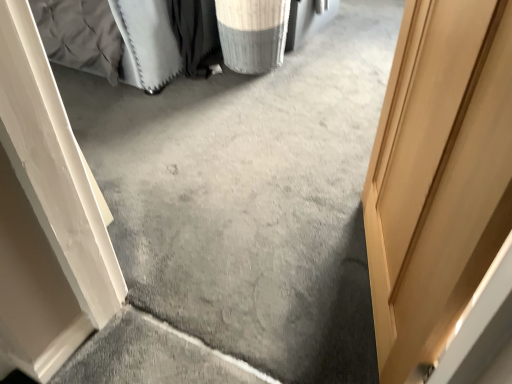
Describe the element at coordinates (252, 34) in the screenshot. I see `white textured laundry basket at upper center` at that location.

Identify the location of white textured laundry basket at upper center. Image resolution: width=512 pixels, height=384 pixels. (252, 34).

The width and height of the screenshot is (512, 384). Identify the location of light brown wooden door at right. (438, 175).

The image size is (512, 384). What do you see at coordinates (438, 175) in the screenshot?
I see `light brown wooden door at right` at bounding box center [438, 175].

You are a GUI agent. You are given a task and a screenshot of the screen. Output one action in this format:
    pyautogui.click(x=<x>, y=<y>)
    Task: Click on the white textured laundry basket at upper center
    
    Given the screenshot: What is the action you would take?
    pyautogui.click(x=252, y=34)

Which is more to the left, light brown wooden door at right or white textured laundry basket at upper center?

white textured laundry basket at upper center.

In the image, is light brown wooden door at right positioned in front of or behind white textured laundry basket at upper center?

light brown wooden door at right is in front of white textured laundry basket at upper center.

Which is nearer, (383, 280) or (253, 61)?

The point (383, 280) is closer to the camera.

From the image's perspective, would you say light brown wooden door at right is positioned over white textured laundry basket at upper center?

No.

From a real-world perspective, is light brown wooden door at right positioned under white textured laundry basket at upper center based on gravity?

Actually, light brown wooden door at right is physically above white textured laundry basket at upper center in the real world.

Which of these two, light brown wooden door at right or white textured laundry basket at upper center, is thinner?

light brown wooden door at right is thinner.

Consider the image. Can you confirm if light brown wooden door at right is shorter than white textured laundry basket at upper center?

Incorrect, the height of light brown wooden door at right does not fall short of that of white textured laundry basket at upper center.

Does light brown wooden door at right have a smaller size compared to white textured laundry basket at upper center?

Incorrect, light brown wooden door at right is not smaller in size than white textured laundry basket at upper center.

Is light brown wooden door at right situated inside white textured laundry basket at upper center or outside?

The correct answer is: outside.

Are light brown wooden door at right and white textured laundry basket at upper center beside each other?

light brown wooden door at right is not next to white textured laundry basket at upper center, and they're not touching.

Is light brown wooden door at right facing towards white textured laundry basket at upper center?

No, light brown wooden door at right is not facing towards white textured laundry basket at upper center.

How distant is light brown wooden door at right from white textured laundry basket at upper center?

1.43 meters.

The height and width of the screenshot is (384, 512). Find the location of `laundry basket below the light brown wooden door at right (from a real-world perspective)`. laundry basket below the light brown wooden door at right (from a real-world perspective) is located at coordinates (252, 34).

Based on their positions, is white textured laundry basket at upper center located to the left or right of light brown wooden door at right?

Based on their positions, white textured laundry basket at upper center is located to the left of light brown wooden door at right.

Between white textured laundry basket at upper center and light brown wooden door at right, which one is positioned behind?

Positioned behind is white textured laundry basket at upper center.

Is point (238, 8) closer to camera compared to point (394, 161)?

No.

From the image's perspective, which one is positioned lower, white textured laundry basket at upper center or light brown wooden door at right?

light brown wooden door at right, from the image's perspective.

From a real-world perspective, is white textured laundry basket at upper center on top of light brown wooden door at right?

No, from a real-world perspective, white textured laundry basket at upper center is not over light brown wooden door at right

Which object is thinner, white textured laundry basket at upper center or light brown wooden door at right?

light brown wooden door at right is thinner.

In the scene shown: Can you confirm if white textured laundry basket at upper center is taller than light brown wooden door at right?

No.

Does white textured laundry basket at upper center have a larger size compared to light brown wooden door at right?

No, white textured laundry basket at upper center is not bigger than light brown wooden door at right.

Can we say white textured laundry basket at upper center lies outside light brown wooden door at right?

Absolutely, white textured laundry basket at upper center is external to light brown wooden door at right.

Can you see white textured laundry basket at upper center touching light brown wooden door at right?

No, white textured laundry basket at upper center is not beside light brown wooden door at right.

Is white textured laundry basket at upper center facing towards light brown wooden door at right?

No.

What's the angular difference between white textured laundry basket at upper center and light brown wooden door at right's facing directions?

The angular difference between white textured laundry basket at upper center and light brown wooden door at right is 159 degrees.

Looking at this image, measure the distance from white textured laundry basket at upper center to light brown wooden door at right.

white textured laundry basket at upper center and light brown wooden door at right are 4.69 feet apart.

Identify the location of laundry basket that appears behind the light brown wooden door at right. Image resolution: width=512 pixels, height=384 pixels. (252, 34).

This screenshot has width=512, height=384. What are the coordinates of `door below the white textured laundry basket at upper center (from the image's perspective)` in the screenshot? It's located at (438, 175).

Identify the location of laundry basket behind the light brown wooden door at right. point(252,34).